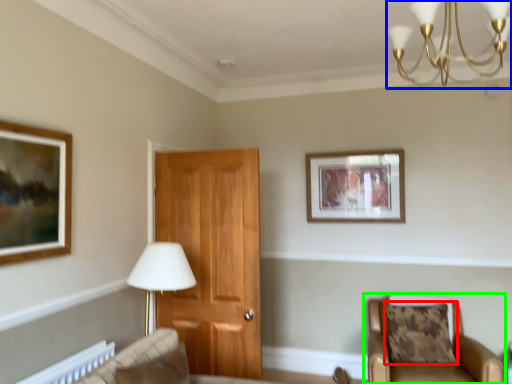
Question: Which object is positioned farthest from pillow (highlighted by a red box)? Select from light fixture (highlighted by a blue box) and chair (highlighted by a green box).

Choices:
 (A) light fixture
 (B) chair

Answer: (A)